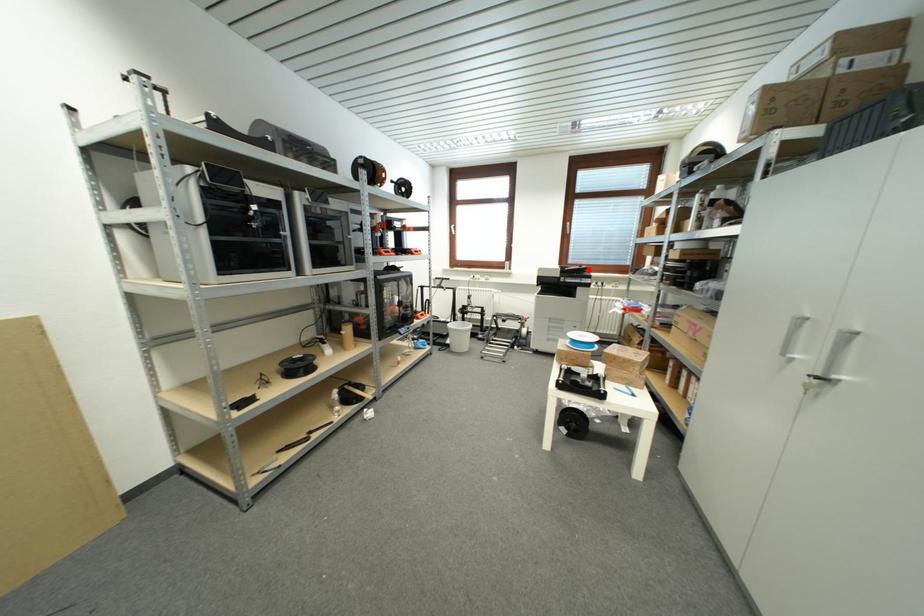
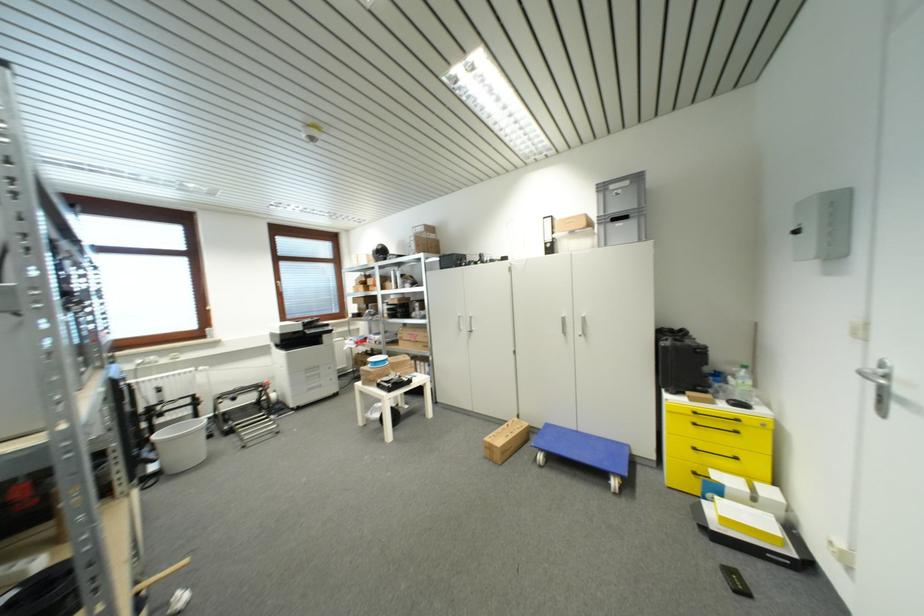
Where in the second image is the point corresponding to the highlighted location from the first image?

(320, 321)